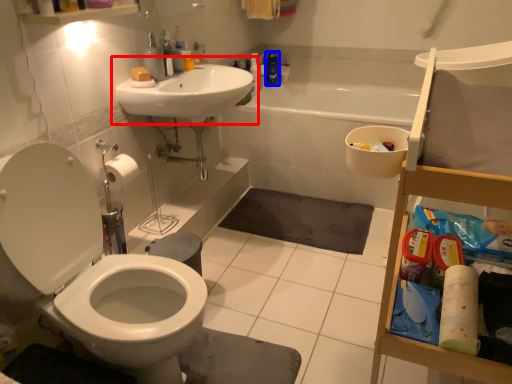
Question: Among these objects, which one is nearest to the camera, sink (highlighted by a red box) or cleaning product (highlighted by a blue box)?

Choices:
 (A) sink
 (B) cleaning product

Answer: (A)